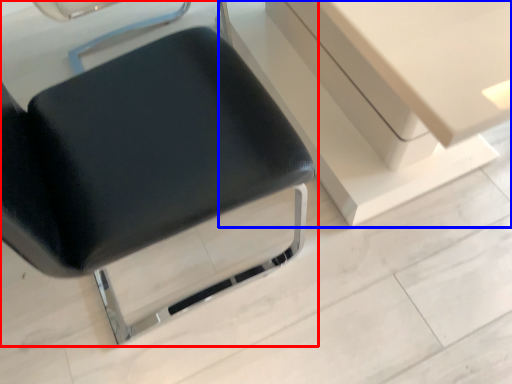
Question: Which object is further to the camera taking this photo, chair (highlighted by a red box) or vanity (highlighted by a blue box)?

Choices:
 (A) chair
 (B) vanity

Answer: (B)